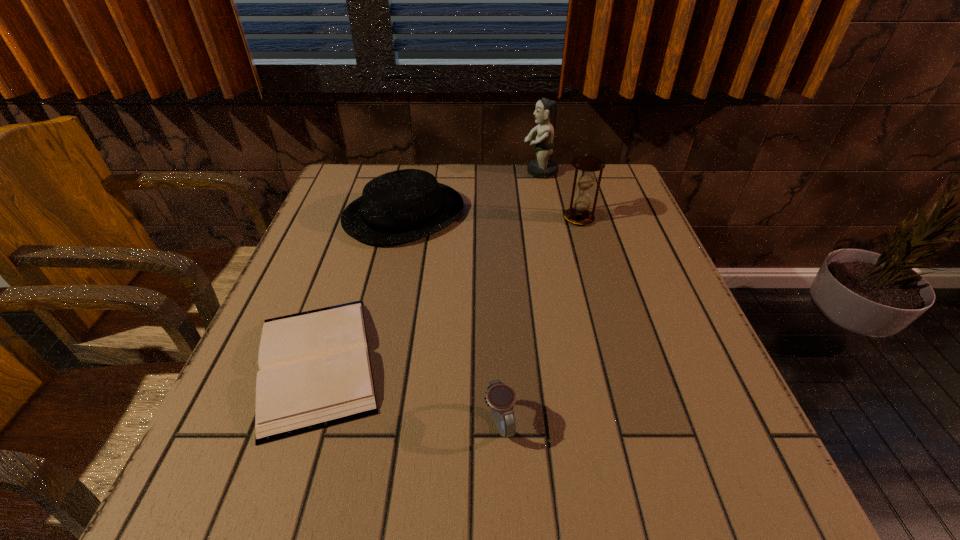
Locate an element on the screen. Image resolution: width=960 pixels, height=540 pixels. vacant region at the far edge is located at coordinates (436, 165).

Where is `free space at the left edge of the desktop`? The width and height of the screenshot is (960, 540). free space at the left edge of the desktop is located at coordinates (211, 454).

Where is `free space at the right edge`? free space at the right edge is located at coordinates (625, 300).

Locate an element on the screen. Image resolution: width=960 pixels, height=540 pixels. free region at the far left corner is located at coordinates (334, 203).

This screenshot has height=540, width=960. Find the location of `free region at the far right corner of the desktop`. free region at the far right corner of the desktop is located at coordinates (605, 172).

This screenshot has width=960, height=540. What are the coordinates of `free region at the near right corner of the desktop` in the screenshot? It's located at (721, 521).

Locate an element on the screen. The height and width of the screenshot is (540, 960). free space between the hourglass and the tallest object is located at coordinates (559, 195).

Identify the location of free space between the shortest object and the third object from left to right. (408, 393).

Where is `free space between the fedora and the third object from left to right`? free space between the fedora and the third object from left to right is located at coordinates (451, 319).

This screenshot has width=960, height=540. Identify the location of empty space between the tallest object and the fedora. (472, 193).